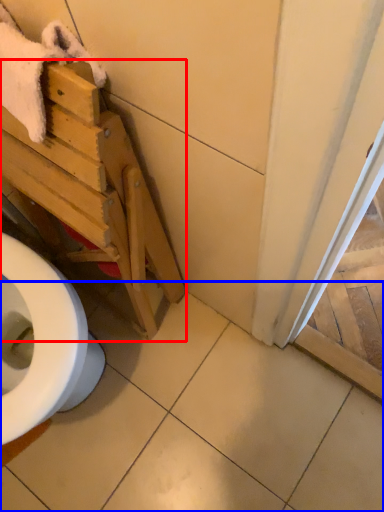
Question: Which of the following is the closest to the observer, furniture (highlighted by a red box) or tile (highlighted by a blue box)?

Choices:
 (A) furniture
 (B) tile

Answer: (A)